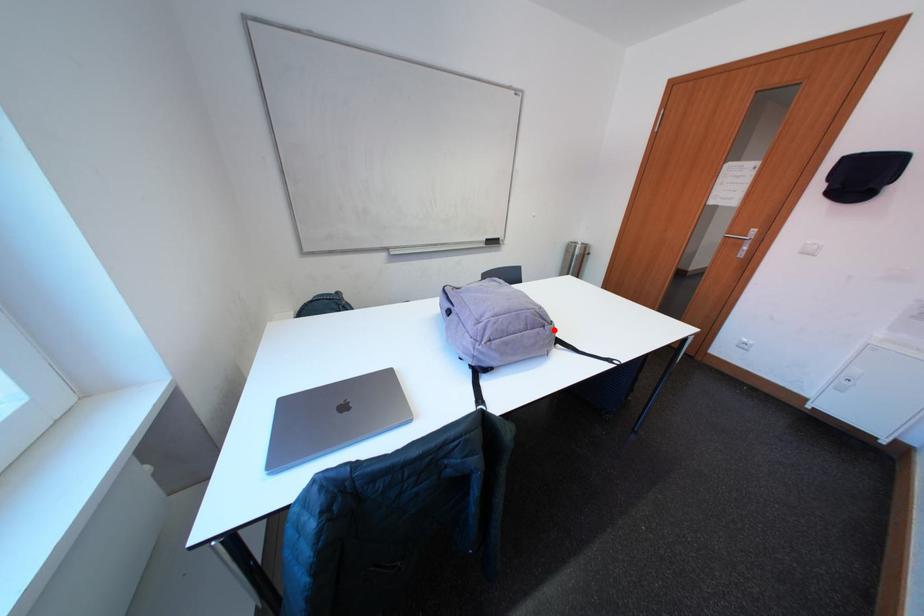
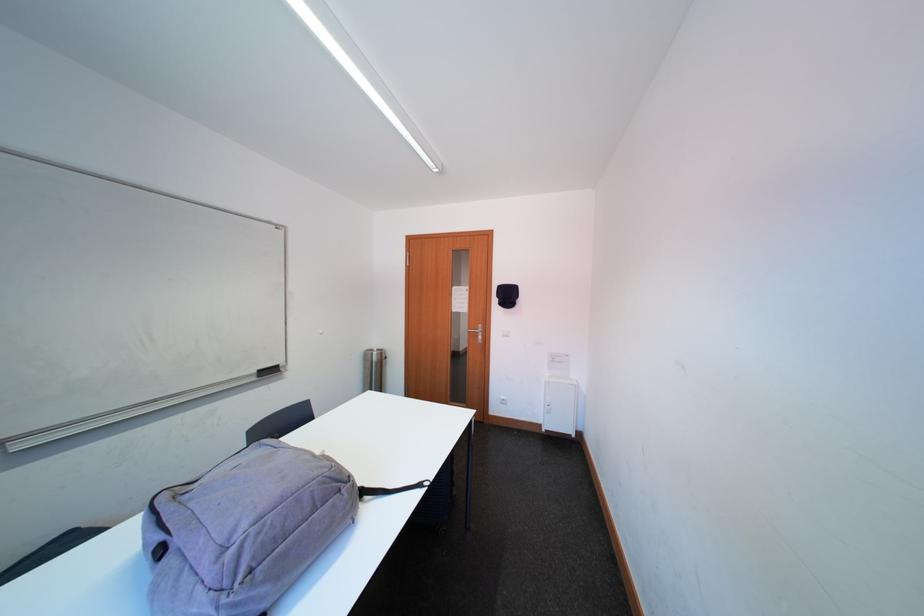
Find the pixel in the second image that matches the highlighted location in the first image.

(349, 493)